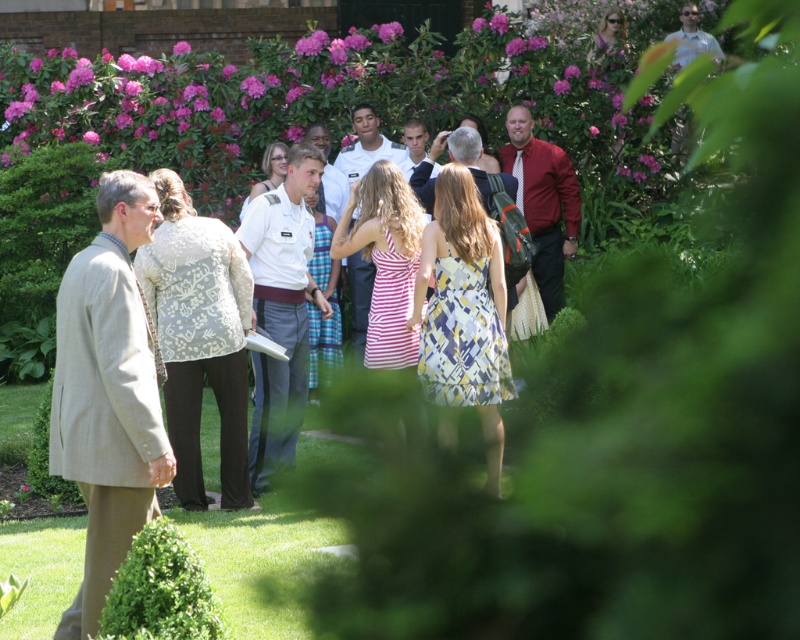
You are a photographer trying to capture a clear photo of both the white uniform at center and the light blue uniform at center. Since you can only focus on one subject at a time, which uniform should you focus on to ensure it appears sharp in the photo?

You should focus on the white uniform at center because it is closer to the viewer than the light blue uniform at center, so focusing on it will keep it sharp while the other may appear slightly blurred.

You are standing in the garden scene and want to move from the point closer to you to the point further away. Which path would you take between the two points, point (293, 337) and point (346, 148)?

The path from point (293, 337) to point (346, 148) would require moving towards the background since point (293, 337) is closer to the viewer and point (346, 148) is further away.

Looking at this image, you are standing in the garden and want to hand a document to the person wearing the white uniform at center. Based on their position, where should you approach from to ensure they can see you clearly?

The white uniform at center is located at point (281, 310), so you should approach from the front to ensure they can see you clearly.